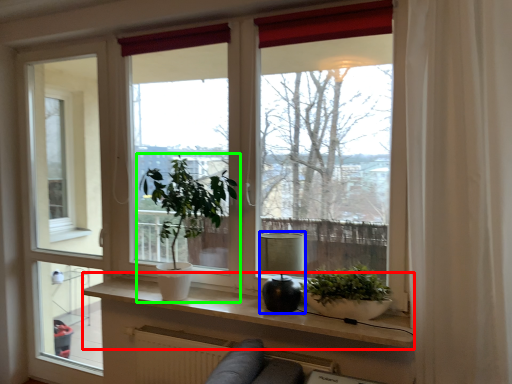
Question: Which object is positioned closest to window sill (highlighted by a red box)? Select from lamp (highlighted by a blue box) and houseplant (highlighted by a green box).

Choices:
 (A) lamp
 (B) houseplant

Answer: (A)